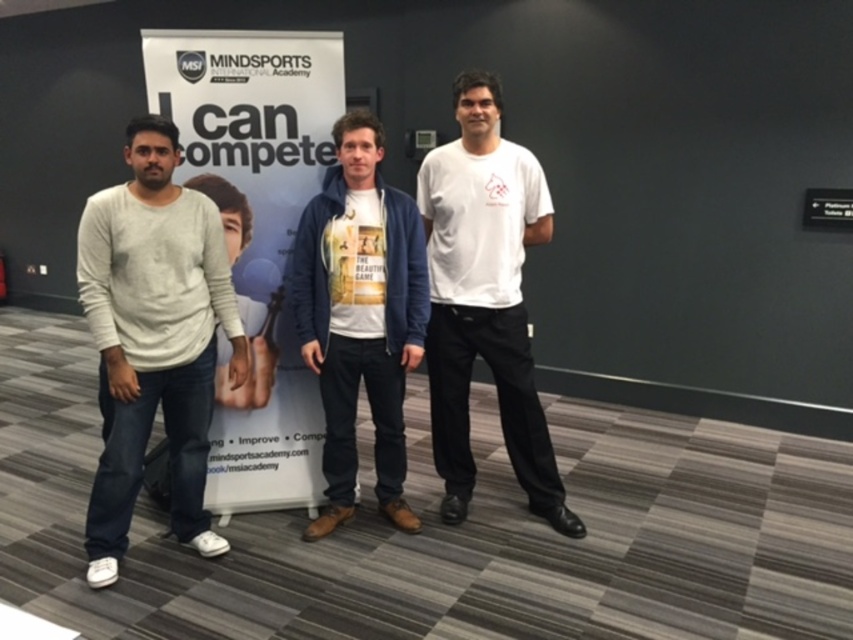
Question: Which of these objects is positioned closest to the light gray sweater at left?

Choices:
 (A) white cotton t-shirt at center
 (B) white matte t-shirt at center

Answer: (A)

Question: Is white paperboard at center bigger than light gray sweater at left?

Choices:
 (A) yes
 (B) no

Answer: (A)

Question: Is white paperboard at center wider than white matte t-shirt at center?

Choices:
 (A) yes
 (B) no

Answer: (A)

Question: Can you confirm if white paperboard at center is positioned below white matte t-shirt at center?

Choices:
 (A) no
 (B) yes

Answer: (A)

Question: Which point is farther from the camera taking this photo?

Choices:
 (A) (131, 381)
 (B) (373, 348)

Answer: (B)

Question: Estimate the real-world distances between objects in this image. Which object is farther from the light gray sweater at left?

Choices:
 (A) white paperboard at center
 (B) white matte t-shirt at center

Answer: (B)